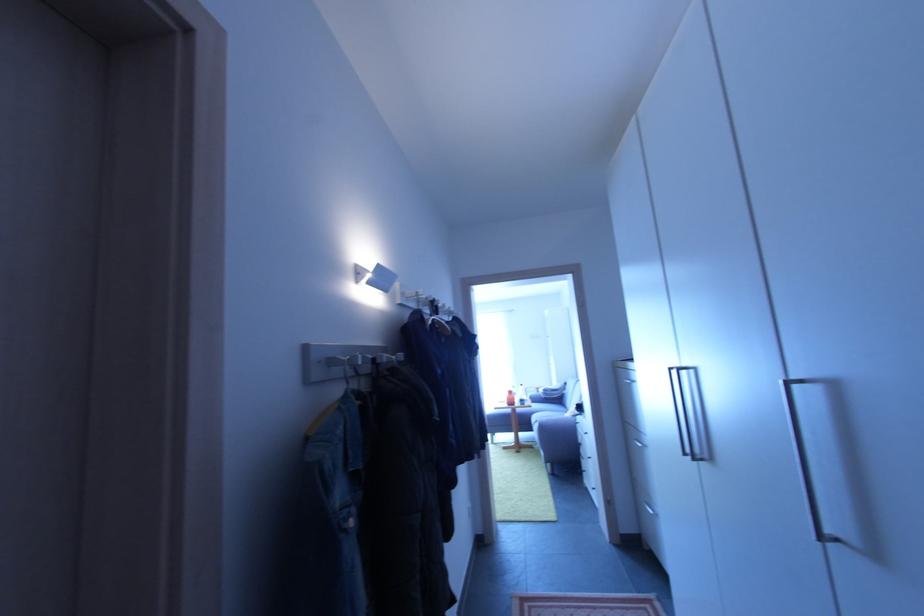
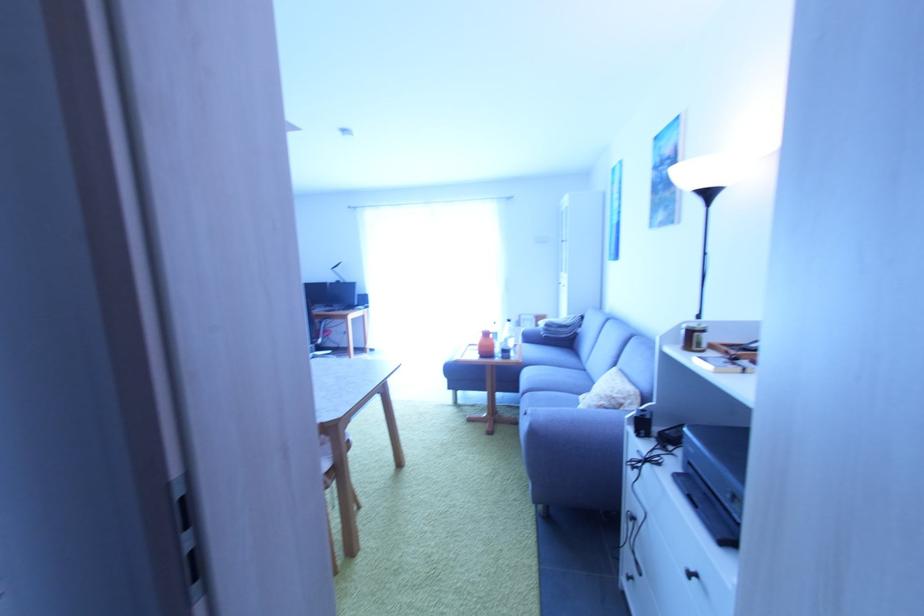
The point at (540, 421) is marked in the first image. Where is the corresponding point in the second image?

(530, 378)